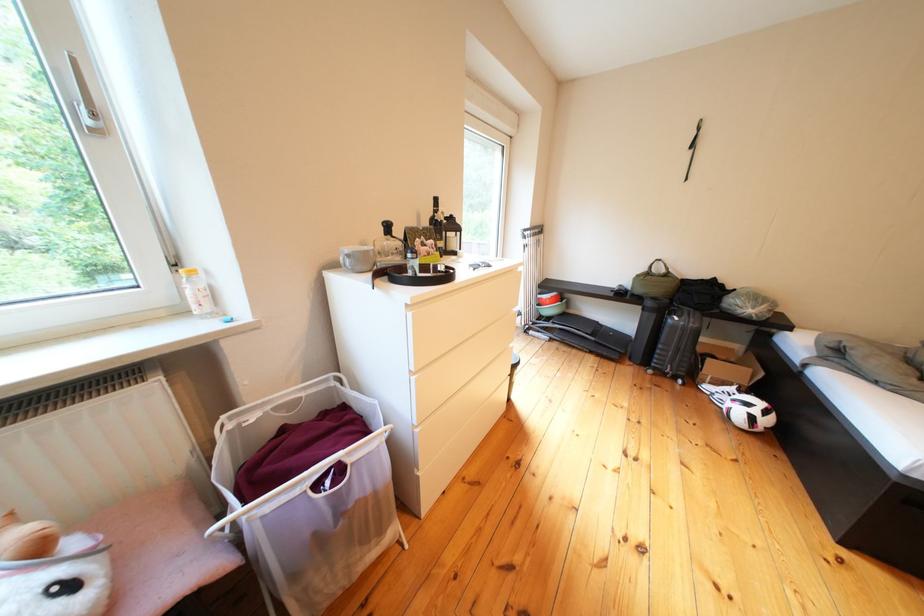
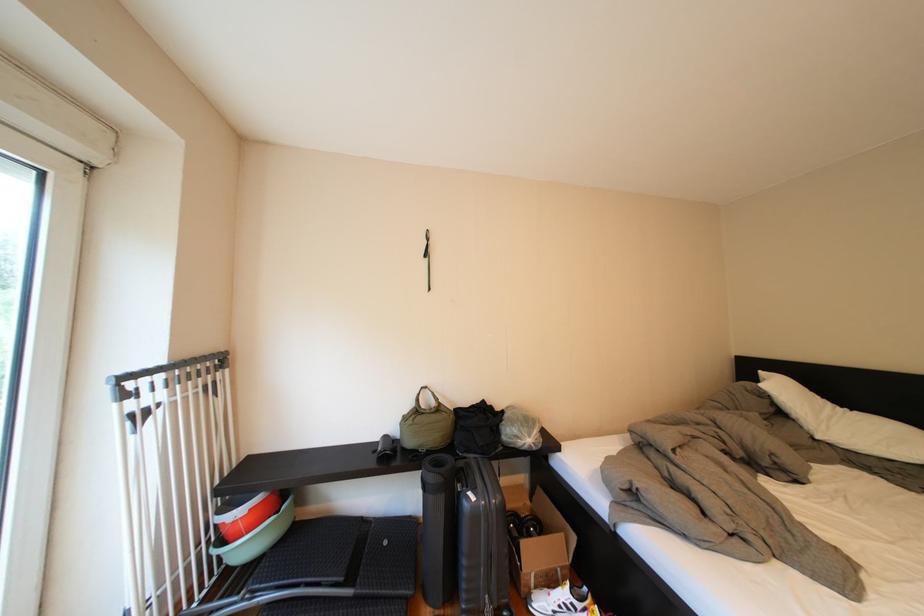
Locate, in the second image, the point that corresponds to (609,346) in the first image.

(370, 602)